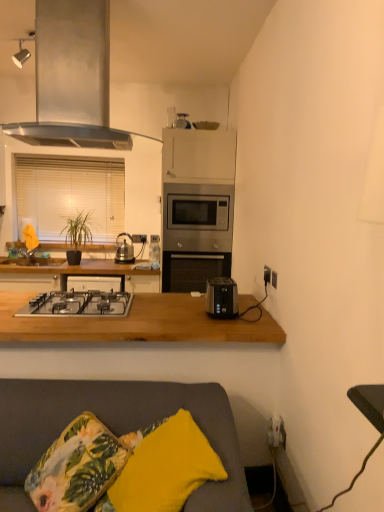
The height and width of the screenshot is (512, 384). What are the coordinates of `vacant space to the right of black plastic toaster at right` in the screenshot? It's located at (258, 314).